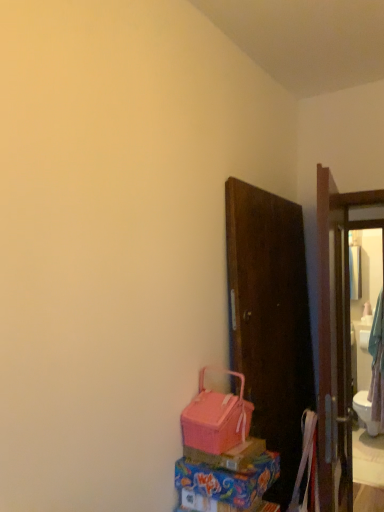
Question: Could you tell me if matte pink plastic box at lower center, which is the second box in top-to-bottom order, is facing pink plastic box at lower center, arranged as the 1th box when viewed from the top?

Choices:
 (A) no
 (B) yes

Answer: (A)

Question: From the image's perspective, is matte pink plastic box at lower center, which is the second box in top-to-bottom order, on pink plastic box at lower center, arranged as the second box when ordered from the bottom?

Choices:
 (A) no
 (B) yes

Answer: (A)

Question: From a real-world perspective, does matte pink plastic box at lower center, which is the second box in top-to-bottom order, stand above pink plastic box at lower center, arranged as the second box when ordered from the bottom?

Choices:
 (A) no
 (B) yes

Answer: (A)

Question: Is matte pink plastic box at lower center, which ranks as the 1th box in bottom-to-top order, surrounding pink plastic box at lower center, arranged as the 1th box when viewed from the top?

Choices:
 (A) no
 (B) yes

Answer: (A)

Question: Can you confirm if matte pink plastic box at lower center, which ranks as the 1th box in bottom-to-top order, is thinner than pink plastic box at lower center, arranged as the 1th box when viewed from the top?

Choices:
 (A) yes
 (B) no

Answer: (B)

Question: From the image's perspective, relative to matte pink plastic box at lower center, which ranks as the 1th box in bottom-to-top order, is matte glass mirror at right above or below?

Choices:
 (A) above
 (B) below

Answer: (B)

Question: Choose the correct answer: Is matte glass mirror at right inside matte pink plastic box at lower center, which is the second box in top-to-bottom order, or outside it?

Choices:
 (A) inside
 (B) outside

Answer: (B)

Question: Looking at their shapes, would you say matte glass mirror at right is wider or thinner than matte pink plastic box at lower center, which is the second box in top-to-bottom order?

Choices:
 (A) thin
 (B) wide

Answer: (A)

Question: Does point (357, 402) appear closer or farther from the camera than point (258, 475)?

Choices:
 (A) farther
 (B) closer

Answer: (A)

Question: Considering the positions of pink plastic box at lower center, arranged as the 1th box when viewed from the top, and matte pink plastic box at lower center, which is the second box in top-to-bottom order, in the image, is pink plastic box at lower center, arranged as the 1th box when viewed from the top, taller or shorter than matte pink plastic box at lower center, which is the second box in top-to-bottom order,?

Choices:
 (A) tall
 (B) short

Answer: (B)

Question: From a real-world perspective, is pink plastic box at lower center, arranged as the second box when ordered from the bottom, above or below matte pink plastic box at lower center, which is the second box in top-to-bottom order?

Choices:
 (A) above
 (B) below

Answer: (A)

Question: Considering their positions, is pink plastic box at lower center, arranged as the second box when ordered from the bottom, located in front of or behind matte pink plastic box at lower center, which ranks as the 1th box in bottom-to-top order?

Choices:
 (A) front
 (B) behind

Answer: (B)

Question: Considering the positions of pink plastic box at lower center, arranged as the second box when ordered from the bottom, and matte pink plastic box at lower center, which ranks as the 1th box in bottom-to-top order, in the image, is pink plastic box at lower center, arranged as the second box when ordered from the bottom, bigger or smaller than matte pink plastic box at lower center, which ranks as the 1th box in bottom-to-top order,?

Choices:
 (A) small
 (B) big

Answer: (A)

Question: Is point (211, 430) closer or farther from the camera than point (185, 458)?

Choices:
 (A) farther
 (B) closer

Answer: (B)

Question: Considering the relative positions of pink fabric basket at lower center and pink plastic box at lower center, arranged as the second box when ordered from the bottom, in the image provided, is pink fabric basket at lower center to the left or to the right of pink plastic box at lower center, arranged as the second box when ordered from the bottom,?

Choices:
 (A) right
 (B) left

Answer: (B)